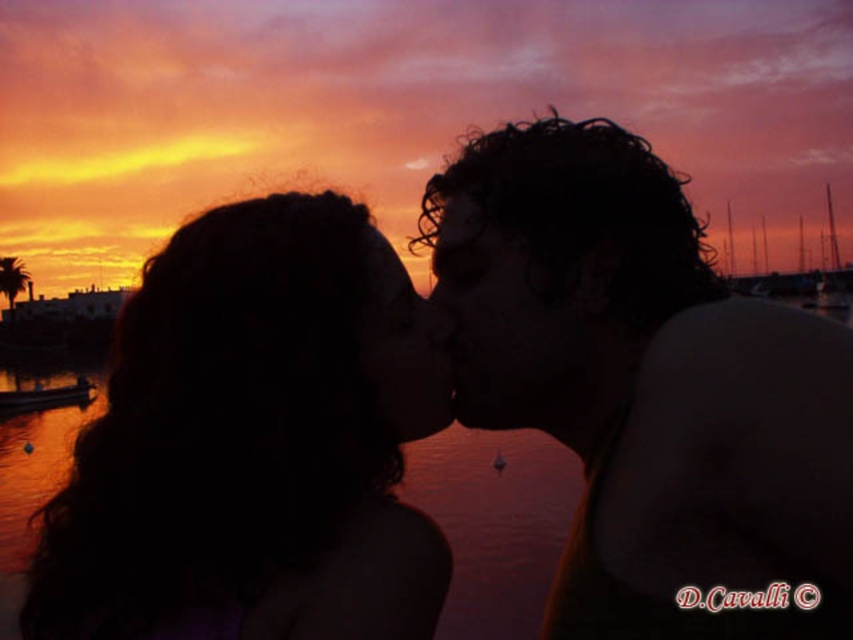
Question: Which point is closer to the camera taking this photo?

Choices:
 (A) (746, 451)
 (B) (22, 401)
 (C) (312, 534)

Answer: (A)

Question: From the image, what is the correct spatial relationship of smooth skin forehead at center in relation to wooden boat at lower left?

Choices:
 (A) left
 (B) right

Answer: (B)

Question: Among these points, which one is farthest from the camera?

Choices:
 (A) (0, 410)
 (B) (691, 339)
 (C) (430, 596)

Answer: (A)

Question: Is dark curly hair at center smaller than dark hair at center?

Choices:
 (A) yes
 (B) no

Answer: (B)

Question: Considering the relative positions of dark curly hair at center and smooth skin forehead at center in the image provided, where is dark curly hair at center located with respect to smooth skin forehead at center?

Choices:
 (A) below
 (B) above

Answer: (A)

Question: Which object appears closest to the camera in this image?

Choices:
 (A) dark hair at center
 (B) dark curly hair at center
 (C) wooden boat at lower left
 (D) smooth skin forehead at center

Answer: (B)